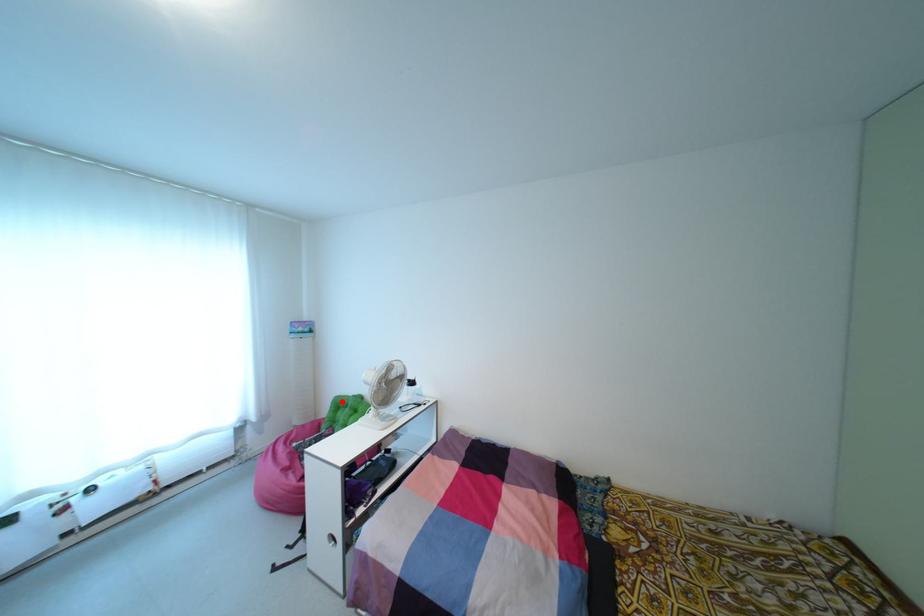
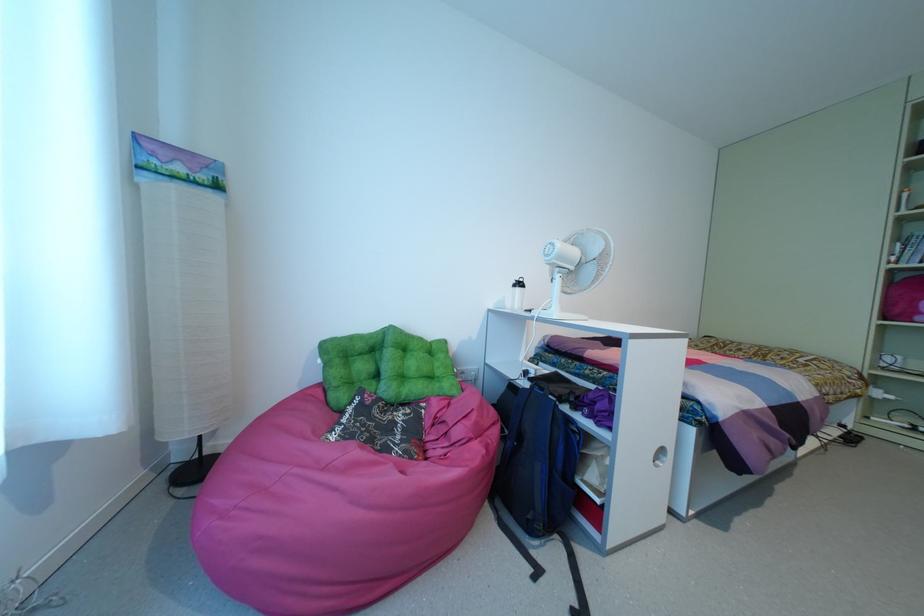
Question: I am providing you with two images of the same scene from different viewpoints. Given a red point in image1, look at the same physical point in image2. Is it:

Choices:
 (A) Closer to the viewpoint
 (B) Farther from the viewpoint

Answer: (A)